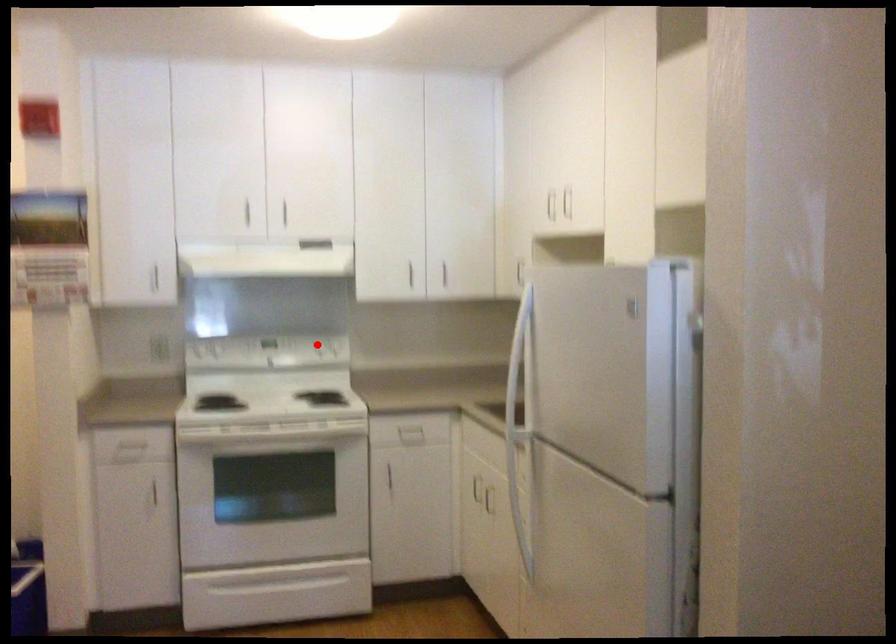
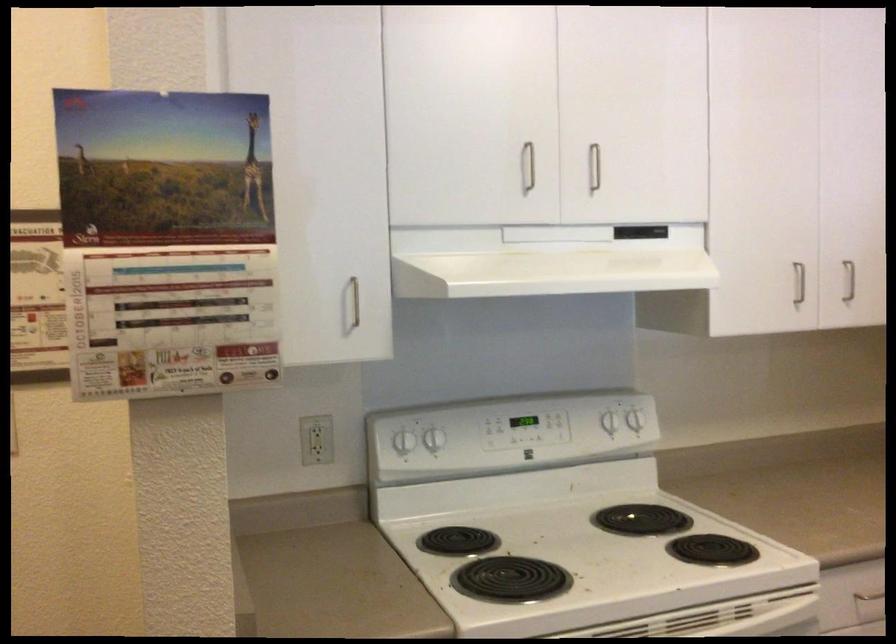
Question: I am providing you with two images of the same scene from different viewpoints. A red point is marked on the first image. Can you still see the location of the red point in image 2?

Choices:
 (A) Yes
 (B) No

Answer: (A)